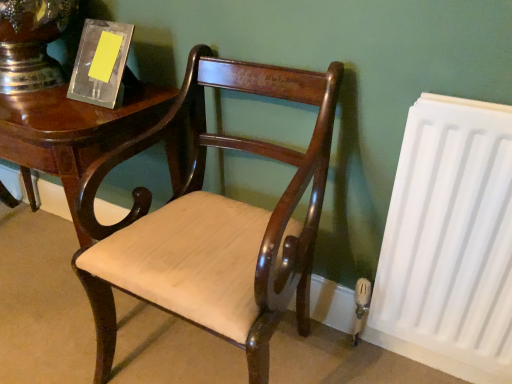
Question: Is white matte radiator at right in front of or behind shiny dark wood table at left in the image?

Choices:
 (A) front
 (B) behind

Answer: (A)

Question: Considering the positions of point (382, 259) and point (79, 102), is point (382, 259) closer or farther from the camera than point (79, 102)?

Choices:
 (A) closer
 (B) farther

Answer: (A)

Question: Which object is positioned closest to the shiny dark wood table at left?

Choices:
 (A) white matte radiator at right
 (B) mahogany wood chair at center

Answer: (B)

Question: Which object is the closest to the white matte radiator at right?

Choices:
 (A) shiny dark wood table at left
 (B) mahogany wood chair at center

Answer: (B)